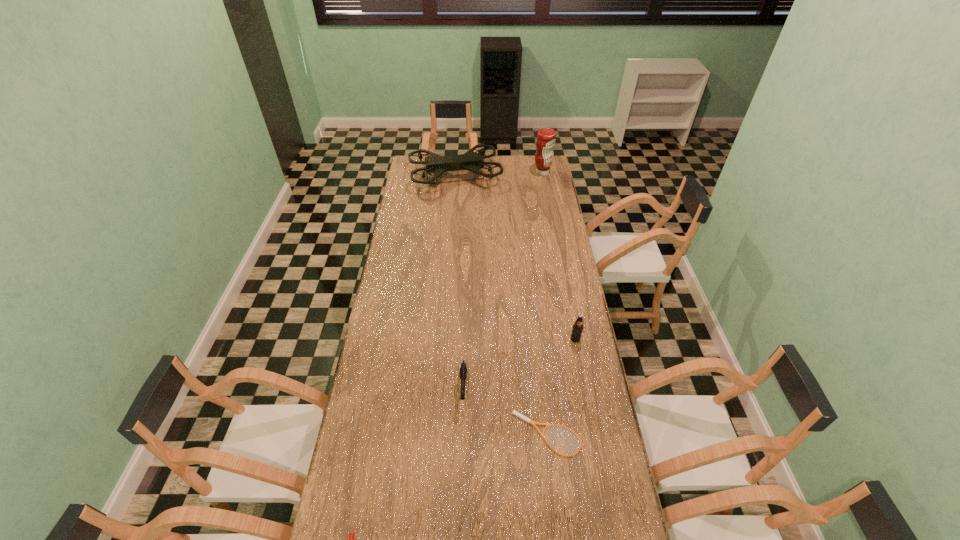
Where is `vacant space located on the front label of the third farthest object`? The height and width of the screenshot is (540, 960). vacant space located on the front label of the third farthest object is located at coordinates (580, 364).

Find the location of a particular element. The image size is (960, 540). free spot located at the end of the barrel of the gun is located at coordinates [x=461, y=491].

The image size is (960, 540). Identify the location of free point located on the front of the fifth farthest object. click(558, 521).

The width and height of the screenshot is (960, 540). Identify the location of drone that is at the far edge. (472, 161).

At what (x,y) coordinates should I click in order to perform the action: click on condiment situated at the far edge. Please return your answer as a coordinate pair (x, y). Looking at the image, I should click on (546, 139).

Find the location of `object that is at the left edge`. object that is at the left edge is located at coordinates (472, 161).

Locate an element on the screen. The image size is (960, 540). condiment present at the right edge is located at coordinates (546, 139).

You are a GUI agent. You are given a task and a screenshot of the screen. Output one action in this format:
    pyautogui.click(x=<x>, y=<y>)
    Task: Click on the pop at the right edge
    This screenshot has width=960, height=540.
    Given the screenshot: What is the action you would take?
    pyautogui.click(x=577, y=329)

You are a GUI agent. You are given a task and a screenshot of the screen. Output one action in this format:
    pyautogui.click(x=<x>, y=<y>)
    Task: Click on the tennis racket that is at the right edge
    This screenshot has width=960, height=540.
    Given the screenshot: What is the action you would take?
    pyautogui.click(x=514, y=412)

This screenshot has width=960, height=540. In order to click on object located at the far left corner in this screenshot , I will do `click(472, 161)`.